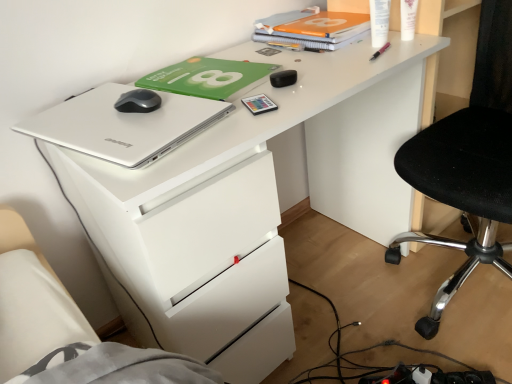
This screenshot has height=384, width=512. I want to click on free space in front of orange matte notebook at upper center, so click(x=335, y=56).